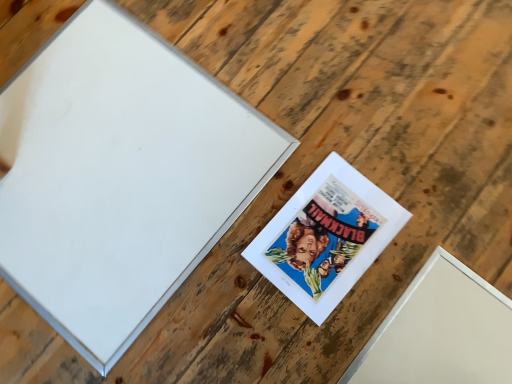
I want to click on free point below white matte picture frame at upper left, placed as the 2th picture frame when sorted from right to left (from a real-world perspective), so click(115, 163).